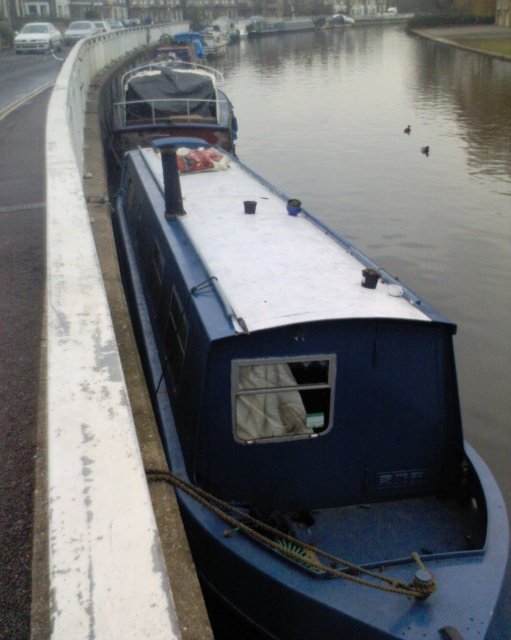
You are standing on the canal bank and want to board the blue matte barge at center. The barge is 3.61 meters away from you. You have a 3.5 meter long plank. Can you use the plank to reach the barge?

The blue matte barge at center is 3.61 meters from camera. Since the plank is only 3.5 meters long, it is 0.11 meters shorter than the distance required. Therefore, the plank is not long enough to safely reach the barge.

You are standing on the canal bank and see the point marked at coordinates (303, 410). What object is located at that point?

The point at coordinates (303, 410) indicates the blue matte barge at center.